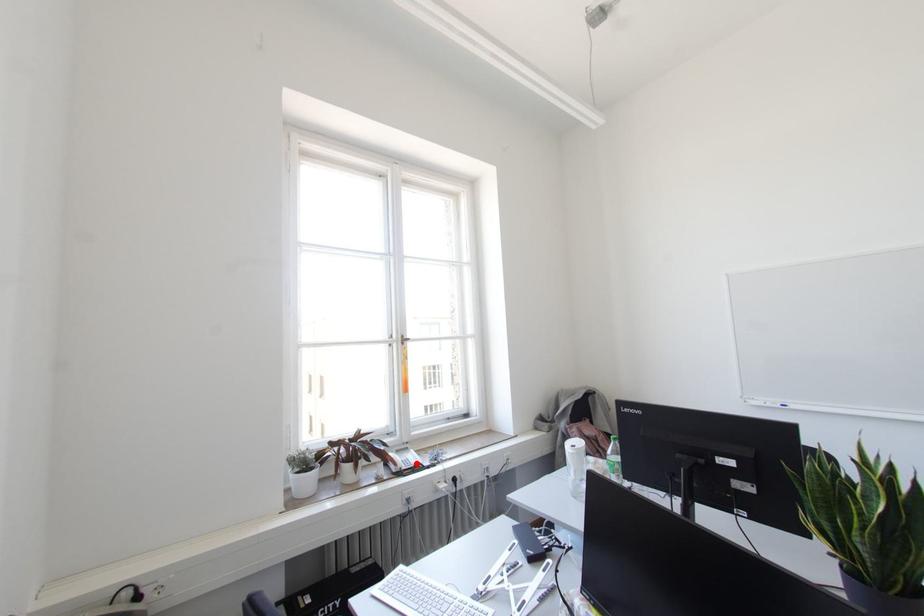
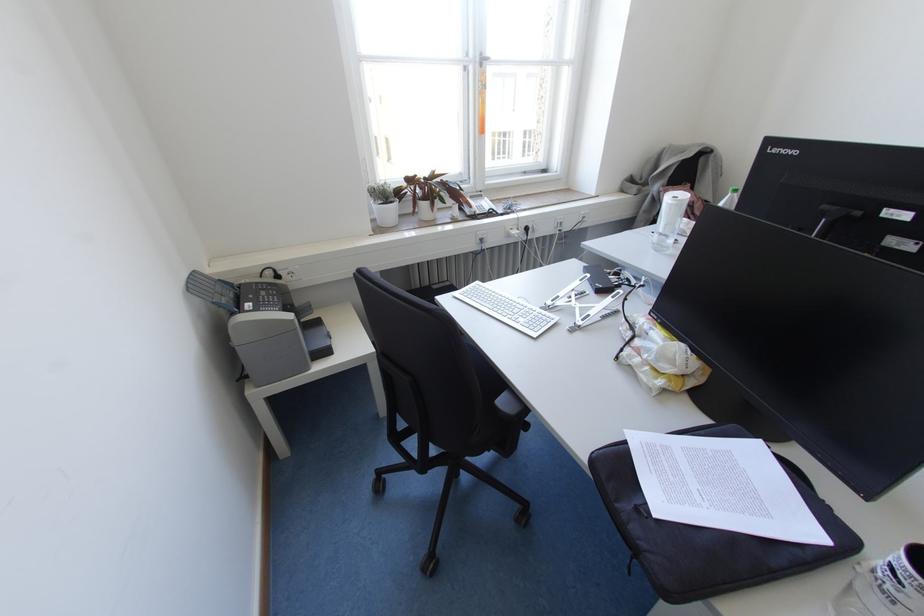
Question: A red point is marked in image1. In image2, is the corresponding 3D point closer to the camera or farther? Reply with the corresponding letter.

Choices:
 (A) The corresponding 3D point is closer.
 (B) The corresponding 3D point is farther.

Answer: (A)